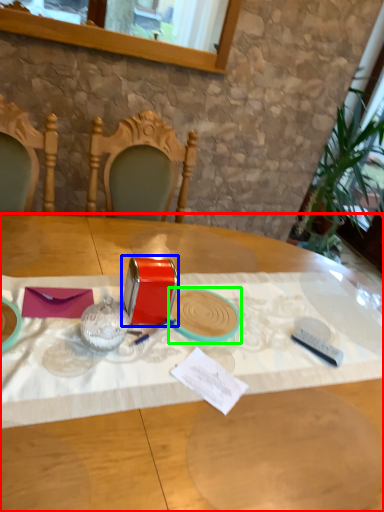
Question: Estimate the real-world distances between objects in this image. Which object is farther from table (highlighted by a red box), tableware (highlighted by a blue box) or tableware (highlighted by a green box)?

Choices:
 (A) tableware
 (B) tableware

Answer: (B)